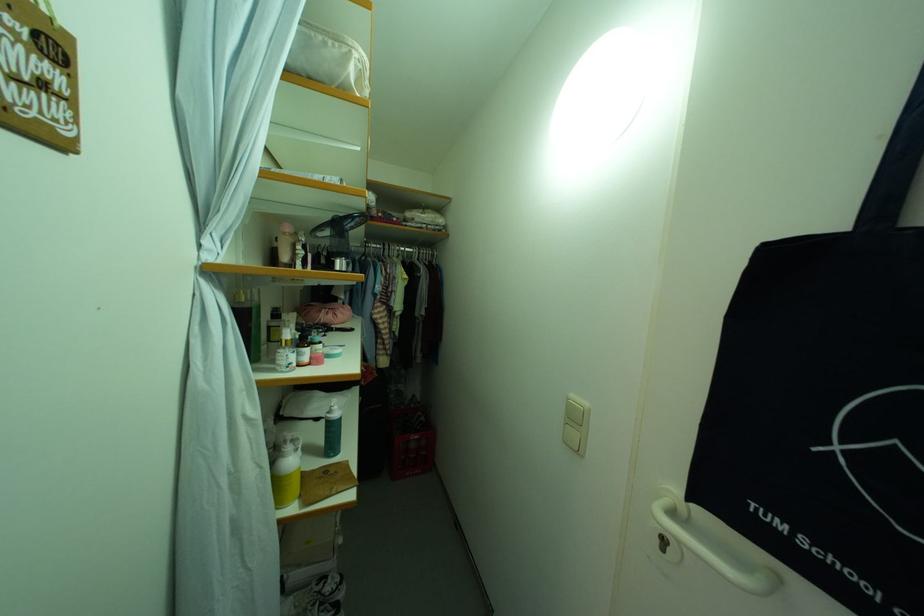
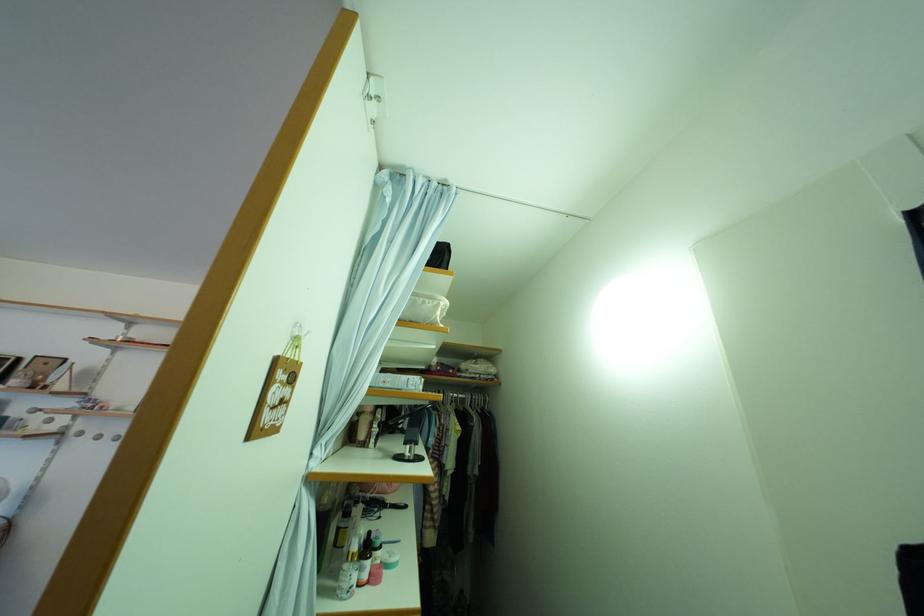
Locate, in the second image, the point that corresponds to point (329, 349) in the first image.

(390, 554)